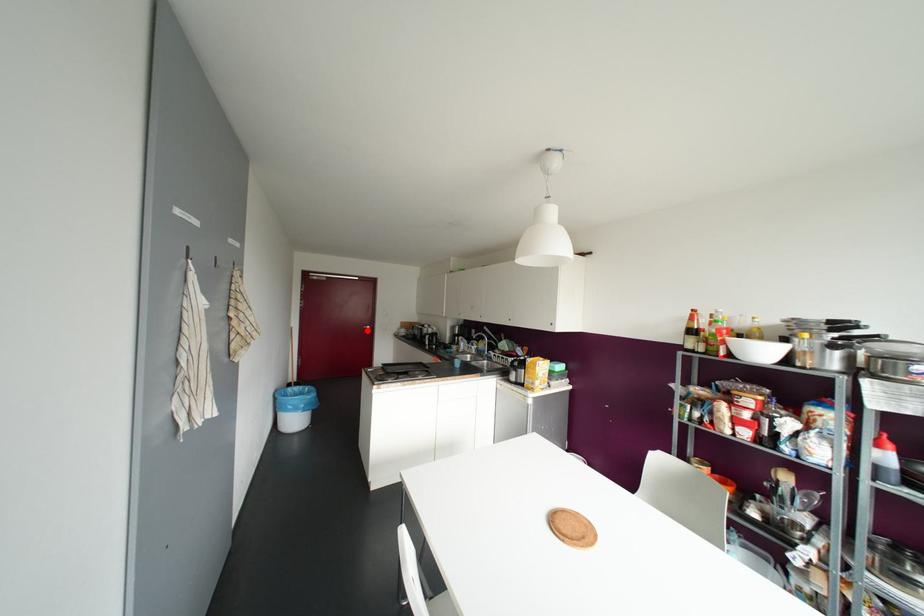
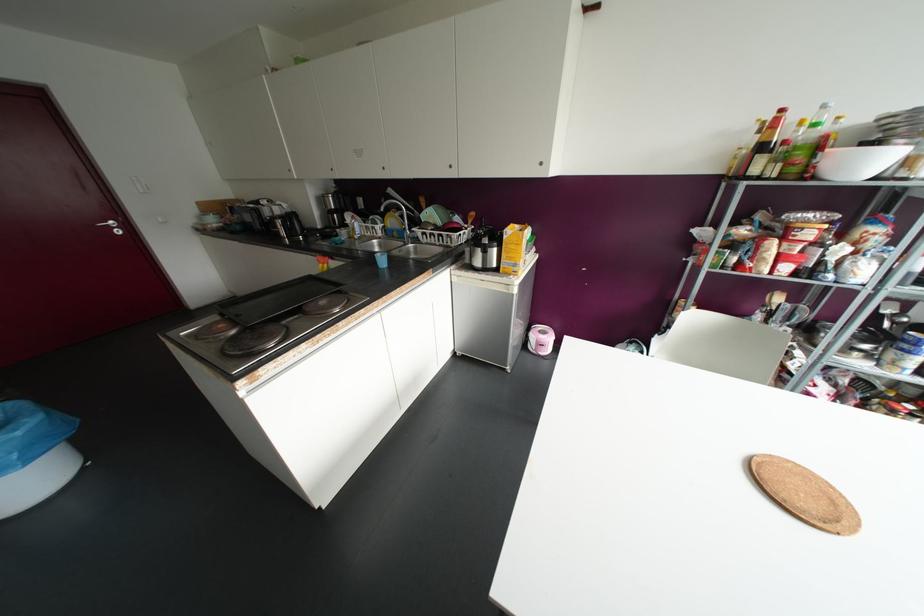
Find the pixel in the second image that matches the highlighted location in the first image.

(117, 232)